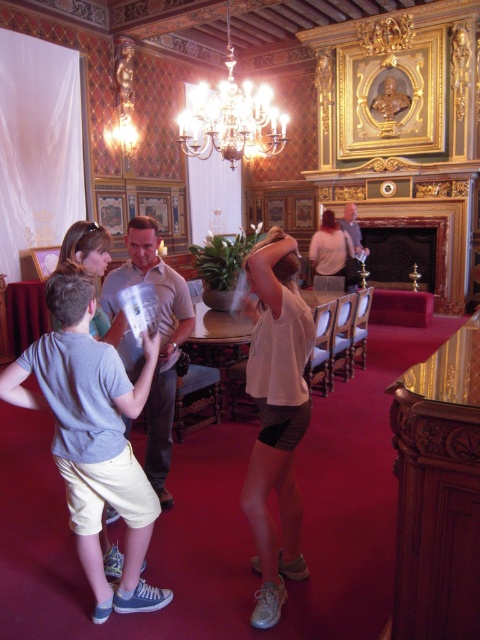
Which is in front, point (91, 564) or point (180, 284)?

Point (91, 564) is in front.

Does light gray cotton shirt at center lie in front of light brown leather shirt at center?

Yes, light gray cotton shirt at center is in front of light brown leather shirt at center.

Does point (63, 280) come behind point (189, 326)?

No.

This screenshot has width=480, height=640. I want to click on light gray cotton shirt at center, so click(93, 436).

Is light gray cotton shirt at center further to camera compared to white cotton tank top at center?

No, light gray cotton shirt at center is in front of white cotton tank top at center.

Based on the photo, is light gray cotton shirt at center above white cotton tank top at center?

No, light gray cotton shirt at center is not above white cotton tank top at center.

Find the location of a particular element. This screenshot has width=480, height=640. light gray cotton shirt at center is located at coordinates (93, 436).

I want to click on light gray cotton shirt at center, so click(93, 436).

Which is in front, point (156, 227) or point (119, 515)?

Positioned in front is point (156, 227).

You are a GUI agent. You are given a task and a screenshot of the screen. Output one action in this format:
    pyautogui.click(x=<x>, y=<y>)
    Task: Click on the light brown leather shirt at center
    This screenshot has height=640, width=480.
    Given the screenshot: What is the action you would take?
    pyautogui.click(x=160, y=339)